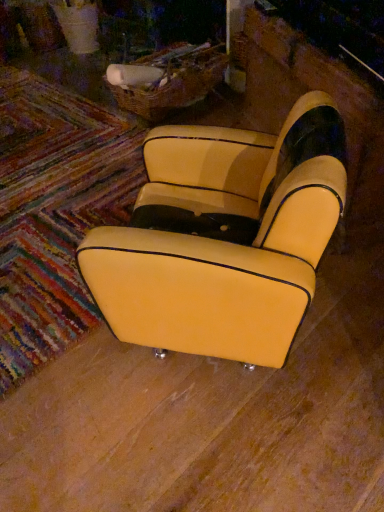
Question: Would you say yellow leather armchair at center is to the left or to the right of yellow leather mat at lower left in the picture?

Choices:
 (A) right
 (B) left

Answer: (A)

Question: From a real-world perspective, is yellow leather armchair at center physically located above or below yellow leather mat at lower left?

Choices:
 (A) above
 (B) below

Answer: (A)

Question: Considering the positions of point (307, 190) and point (115, 188), is point (307, 190) closer or farther from the camera than point (115, 188)?

Choices:
 (A) farther
 (B) closer

Answer: (B)

Question: From their relative heights in the image, would you say yellow leather mat at lower left is taller or shorter than yellow leather armchair at center?

Choices:
 (A) tall
 (B) short

Answer: (B)

Question: Based on their positions, is yellow leather mat at lower left located to the left or right of yellow leather armchair at center?

Choices:
 (A) left
 (B) right

Answer: (A)

Question: Relative to yellow leather armchair at center, is yellow leather mat at lower left in front or behind?

Choices:
 (A) front
 (B) behind

Answer: (B)

Question: From a real-world perspective, is yellow leather mat at lower left positioned above or below yellow leather armchair at center?

Choices:
 (A) above
 (B) below

Answer: (B)